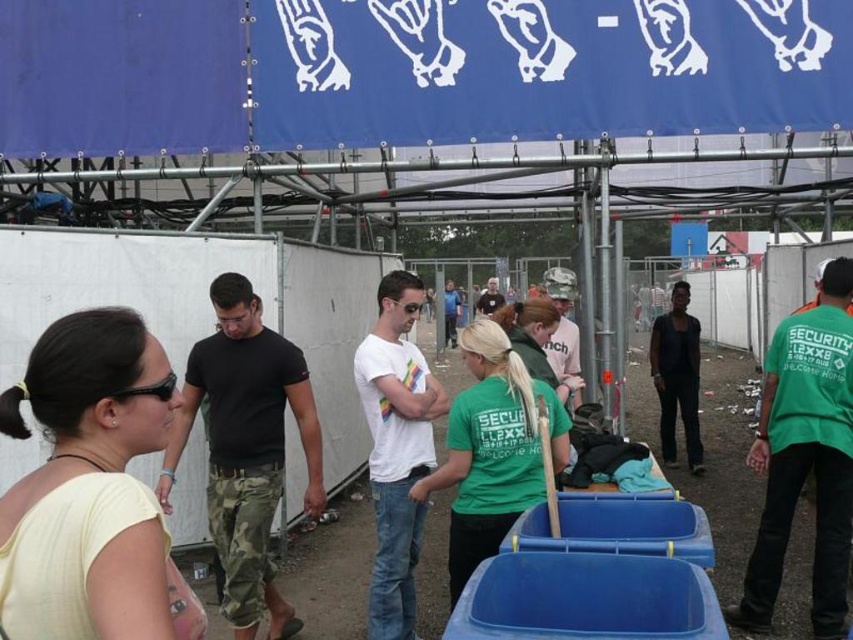
Is yellow matte shirt at lower left positioned before black matte t-shirt at center?

Yes, it is in front of black matte t-shirt at center.

Measure the distance between yellow matte shirt at lower left and black matte t-shirt at center.

yellow matte shirt at lower left and black matte t-shirt at center are 9.57 feet apart.

Image resolution: width=853 pixels, height=640 pixels. Describe the element at coordinates (100, 456) in the screenshot. I see `yellow matte shirt at lower left` at that location.

The image size is (853, 640). What are the coordinates of `yellow matte shirt at lower left` in the screenshot? It's located at (100, 456).

Which of these two, blue fabric canopy at upper center or yellow matte shirt at lower left, stands shorter?

With less height is yellow matte shirt at lower left.

Looking at this image, can you confirm if blue fabric canopy at upper center is wider than yellow matte shirt at lower left?

Indeed, blue fabric canopy at upper center has a greater width compared to yellow matte shirt at lower left.

Locate an element on the screen. The height and width of the screenshot is (640, 853). blue fabric canopy at upper center is located at coordinates (410, 70).

Can you confirm if blue fabric canopy at upper center is positioned below black matte t-shirt at center?

Actually, blue fabric canopy at upper center is above black matte t-shirt at center.

Does point (416, 13) lie in front of point (271, 477)?

No, (416, 13) is further to viewer.

Is point (395, 109) more distant than point (277, 333)?

Yes, point (395, 109) is behind point (277, 333).

This screenshot has height=640, width=853. Find the location of `blue fabric canopy at upper center`. blue fabric canopy at upper center is located at coordinates (410, 70).